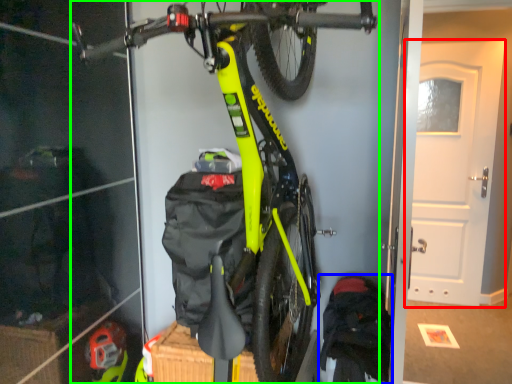
Question: Considering the real-world distances, which object is closest to door (highlighted by a red box)? backpack (highlighted by a blue box) or bicycle (highlighted by a green box).

Choices:
 (A) backpack
 (B) bicycle

Answer: (A)